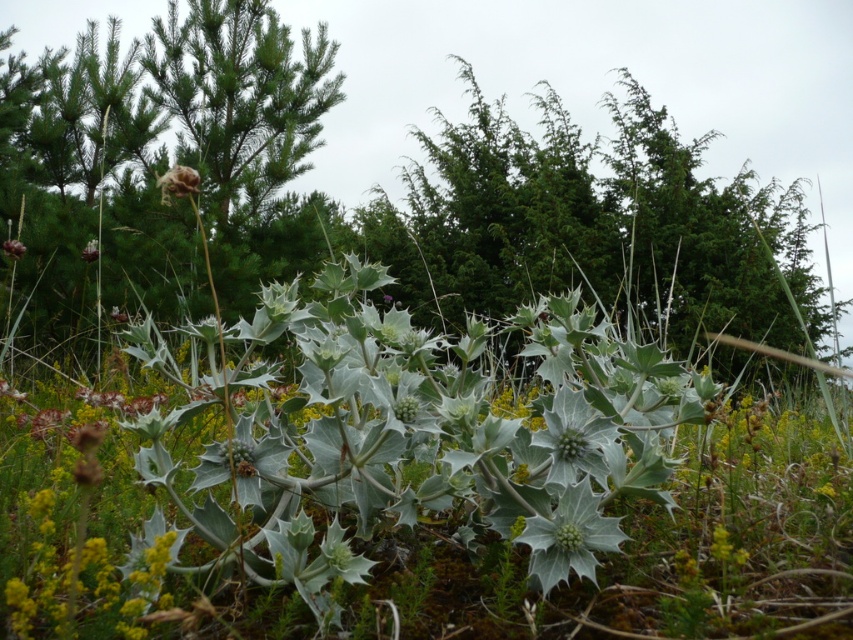
Question: Can you confirm if brown textured flower at upper left is smaller than green matte flower at center?

Choices:
 (A) no
 (B) yes

Answer: (B)

Question: Estimate the real-world distances between objects in this image. Which object is closer to the brown textured flower at upper left?

Choices:
 (A) green matte flower at center
 (B) fuzzy brown flower at upper center

Answer: (B)

Question: Where is brown textured flower at upper left located in relation to green matte flower at center in the image?

Choices:
 (A) above
 (B) below

Answer: (B)

Question: Among these objects, which one is nearest to the camera?

Choices:
 (A) brown textured flower at upper left
 (B) green matte flower at center
 (C) green spiky plant at center
 (D) fuzzy brown flower at upper center

Answer: (D)

Question: Does green spiky plant at center have a smaller size compared to fuzzy brown flower at upper center?

Choices:
 (A) no
 (B) yes

Answer: (A)

Question: Among these objects, which one is nearest to the camera?

Choices:
 (A) brown textured flower at upper left
 (B) green spiky plant at center
 (C) fuzzy brown flower at upper center

Answer: (C)